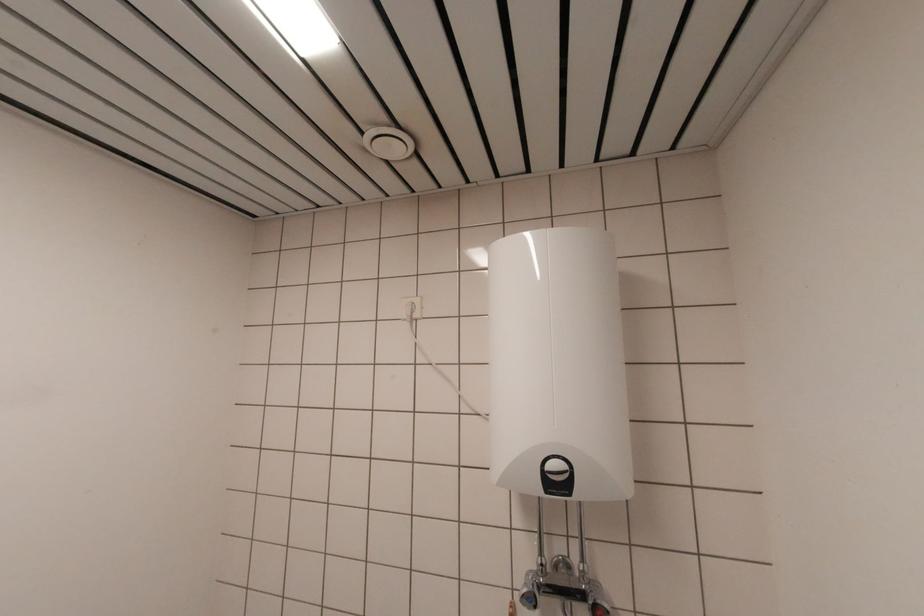
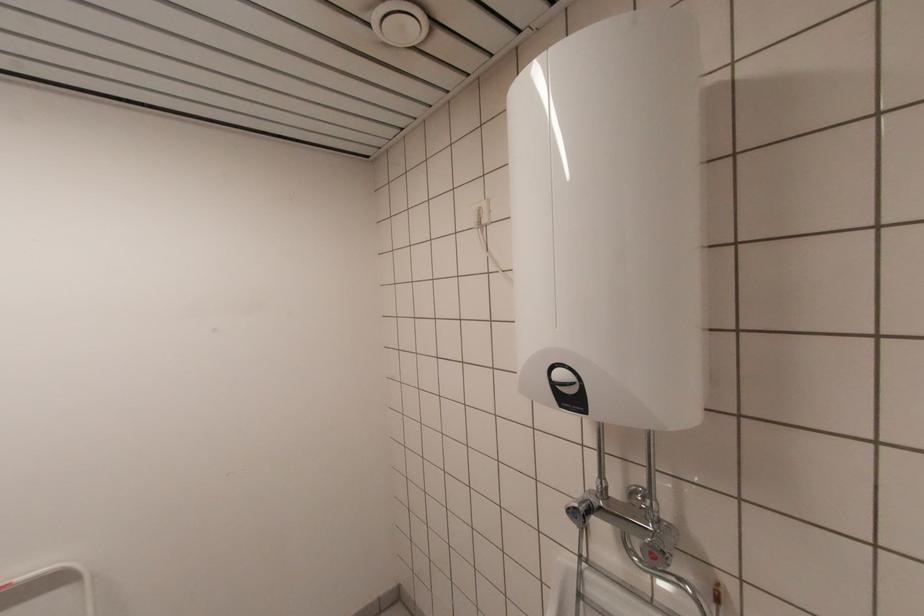
Question: How did the camera likely rotate?

Choices:
 (A) Left
 (B) Right
 (C) Up
 (D) Down

Answer: (A)